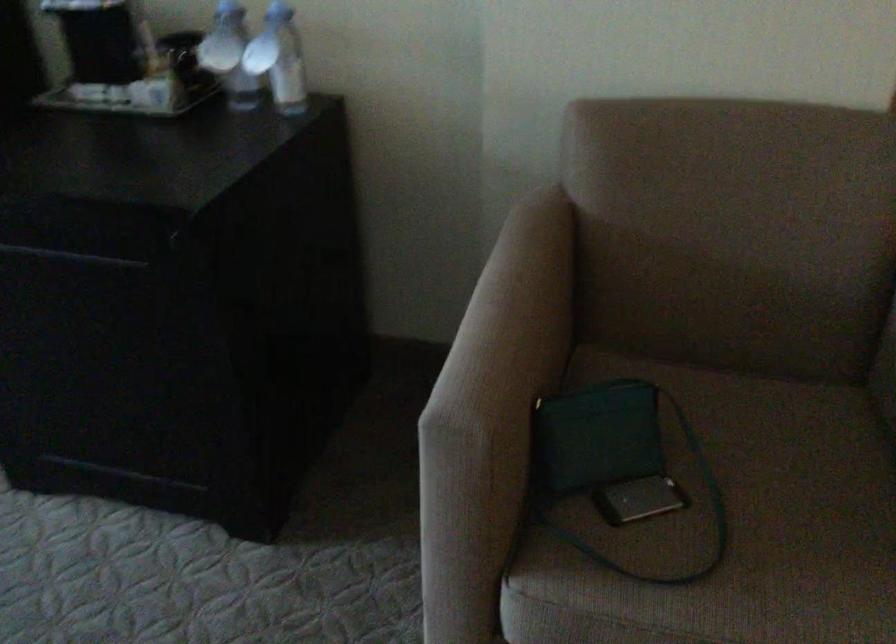
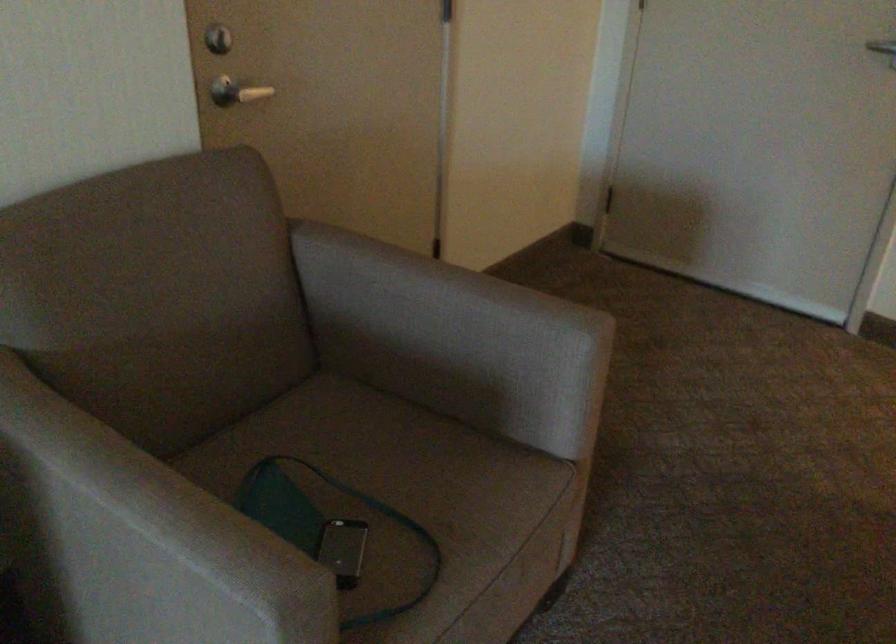
Where in the second image is the point corresponding to pixel 643 496 from the first image?

(342, 550)